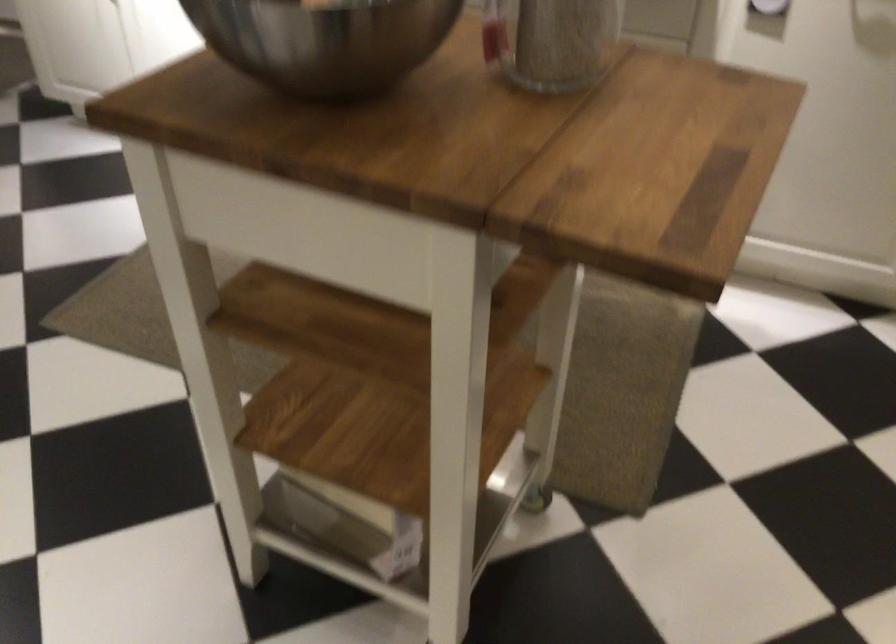
Locate an element on the screen. glass jar is located at coordinates (553, 41).